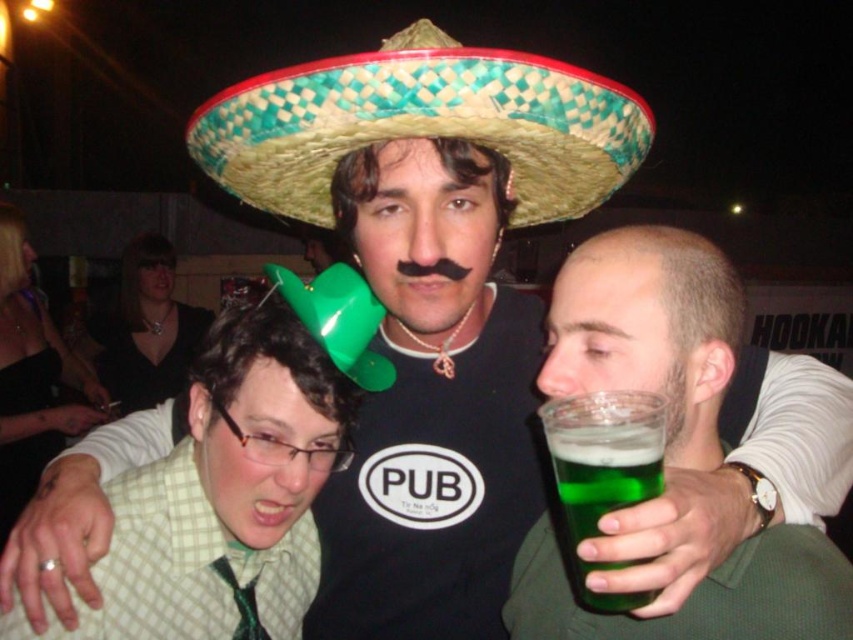
Question: Observing the image, what is the correct spatial positioning of green glass at right in reference to green matte hat at center?

Choices:
 (A) left
 (B) right

Answer: (B)

Question: Can you confirm if green glass at lower right is positioned below green woven straw sombrero at center?

Choices:
 (A) yes
 (B) no

Answer: (A)

Question: Which point appears farthest from the camera in this image?

Choices:
 (A) (358, 368)
 (B) (596, 172)
 (C) (140, 596)

Answer: (A)

Question: Which point is farther from the camera taking this photo?

Choices:
 (A) (194, 116)
 (B) (331, 272)

Answer: (B)

Question: Among these objects, which one is nearest to the camera?

Choices:
 (A) green matte hat at center
 (B) green woven straw sombrero at center
 (C) woven straw sombrero at center

Answer: (C)

Question: Is woven straw sombrero at center wider than green glass at lower right?

Choices:
 (A) yes
 (B) no

Answer: (A)